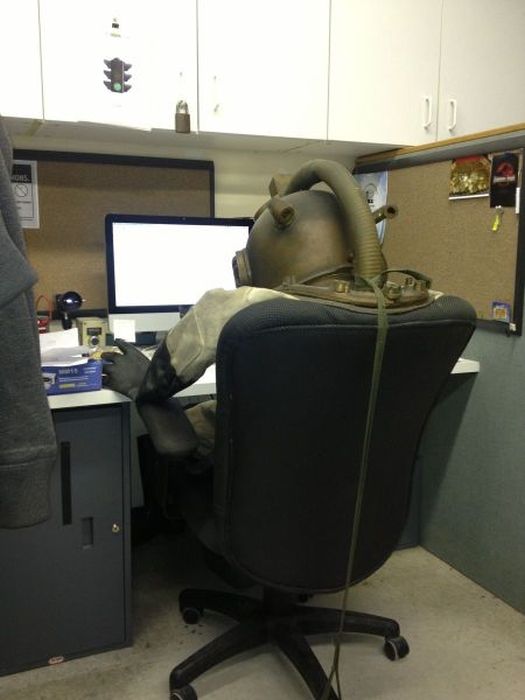
Where is `bulletin board`? Image resolution: width=525 pixels, height=700 pixels. bulletin board is located at coordinates (77, 204), (453, 242).